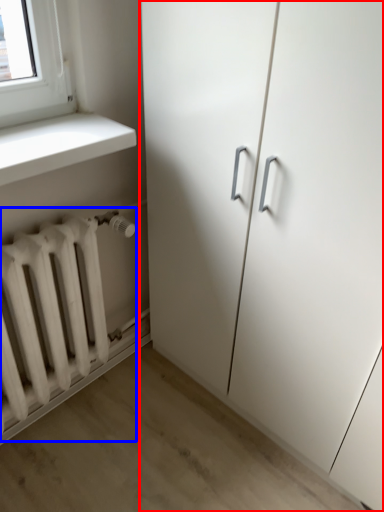
Question: Which of the following is the closest to the observer, cupboard (highlighted by a red box) or radiator (highlighted by a blue box)?

Choices:
 (A) cupboard
 (B) radiator

Answer: (A)